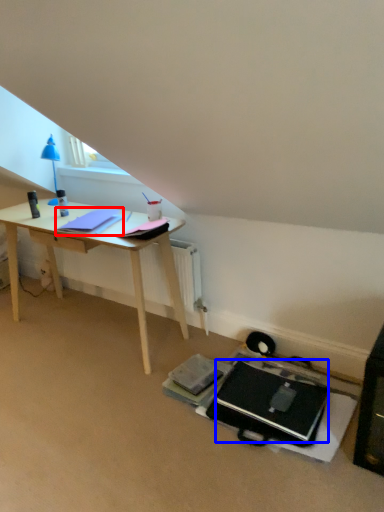
Question: Which object appears farthest to the camera in this image, notepad (highlighted by a red box) or laptop (highlighted by a blue box)?

Choices:
 (A) notepad
 (B) laptop

Answer: (A)